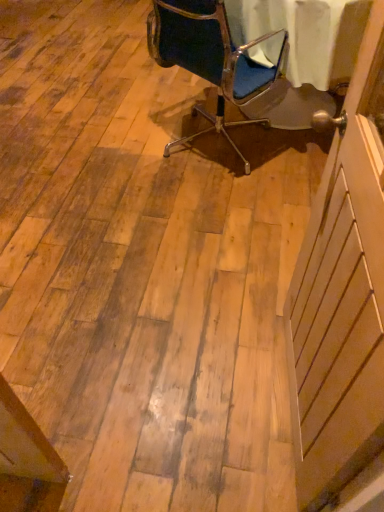
The image size is (384, 512). Describe the element at coordinates (210, 58) in the screenshot. I see `blue fabric chair at upper center` at that location.

Identify the location of blue fabric chair at upper center. [210, 58].

Describe the element at coordinates (342, 297) in the screenshot. I see `white wood screen door at right` at that location.

Measure the distance between white wood screen door at right and camera.

26.28 inches.

Find the location of a particular element. This screenshot has height=512, width=384. white wood screen door at right is located at coordinates (342, 297).

You are a GUI agent. You are given a task and a screenshot of the screen. Output one action in this format:
    pyautogui.click(x=<x>, y=<y>)
    Task: Click on the blue fabric chair at upper center
    
    Given the screenshot: What is the action you would take?
    click(210, 58)

From the picture: Which is more to the right, blue fabric chair at upper center or white wood screen door at right?

From the viewer's perspective, white wood screen door at right appears more on the right side.

Which object is further away from the camera, blue fabric chair at upper center or white wood screen door at right?

blue fabric chair at upper center is further from the camera.

Considering the points (205, 39) and (347, 334), which point is in front, point (205, 39) or point (347, 334)?

Positioned in front is point (347, 334).

From the image's perspective, is blue fabric chair at upper center below white wood screen door at right?

No, from the image's perspective, blue fabric chair at upper center is not beneath white wood screen door at right.

From a real-world perspective, is blue fabric chair at upper center on top of white wood screen door at right?

No, from a real-world perspective, blue fabric chair at upper center is not over white wood screen door at right

Does blue fabric chair at upper center have a lesser width compared to white wood screen door at right?

No.

Is blue fabric chair at upper center shorter than white wood screen door at right?

Correct, blue fabric chair at upper center is not as tall as white wood screen door at right.

Consider the image. Based on their sizes in the image, would you say blue fabric chair at upper center is bigger or smaller than white wood screen door at right?

In the image, blue fabric chair at upper center appears to be larger than white wood screen door at right.

Would you say blue fabric chair at upper center contains white wood screen door at right?

No, blue fabric chair at upper center does not contain white wood screen door at right.

Is blue fabric chair at upper center beside white wood screen door at right?

No, blue fabric chair at upper center is not with white wood screen door at right.

Could you tell me if blue fabric chair at upper center is turned towards white wood screen door at right?

No, blue fabric chair at upper center does not turn towards white wood screen door at right.

What's the angular difference between blue fabric chair at upper center and white wood screen door at right's facing directions?

blue fabric chair at upper center and white wood screen door at right are facing 131 degrees away from each other.

Locate an element on the screen. This screenshot has width=384, height=512. screen door above the blue fabric chair at upper center (from a real-world perspective) is located at coordinates (342, 297).

Which is more to the left, white wood screen door at right or blue fabric chair at upper center?

blue fabric chair at upper center.

Is the position of white wood screen door at right less distant than that of blue fabric chair at upper center?

Yes, white wood screen door at right is closer to the camera.

Between point (316, 343) and point (240, 64), which one is positioned in front?

Point (316, 343)

From the image's perspective, which object appears higher, white wood screen door at right or blue fabric chair at upper center?

blue fabric chair at upper center, from the image's perspective.

From a real-world perspective, is white wood screen door at right physically below blue fabric chair at upper center?

No, from a real-world perspective, white wood screen door at right is not beneath blue fabric chair at upper center.

Considering the relative sizes of white wood screen door at right and blue fabric chair at upper center in the image provided, is white wood screen door at right wider than blue fabric chair at upper center?

In fact, white wood screen door at right might be narrower than blue fabric chair at upper center.

Does white wood screen door at right have a greater height compared to blue fabric chair at upper center?

Yes.

Which of these two, white wood screen door at right or blue fabric chair at upper center, is smaller?

With smaller size is white wood screen door at right.

Is white wood screen door at right not within blue fabric chair at upper center?

white wood screen door at right is positioned outside blue fabric chair at upper center.

Is white wood screen door at right touching blue fabric chair at upper center?

No, white wood screen door at right is not making contact with blue fabric chair at upper center.

Is white wood screen door at right positioned with its back to blue fabric chair at upper center?

No, white wood screen door at right is not facing the opposite direction of blue fabric chair at upper center.

Where is `screen door that is above the blue fabric chair at upper center (from a real-world perspective)`? The width and height of the screenshot is (384, 512). screen door that is above the blue fabric chair at upper center (from a real-world perspective) is located at coordinates (342, 297).

In the image, there is a white wood screen door at right. Where is `chair above it (from the image's perspective)`? This screenshot has height=512, width=384. chair above it (from the image's perspective) is located at coordinates coord(210,58).

Where is `screen door above the blue fabric chair at upper center (from a real-world perspective)`? screen door above the blue fabric chair at upper center (from a real-world perspective) is located at coordinates (342, 297).